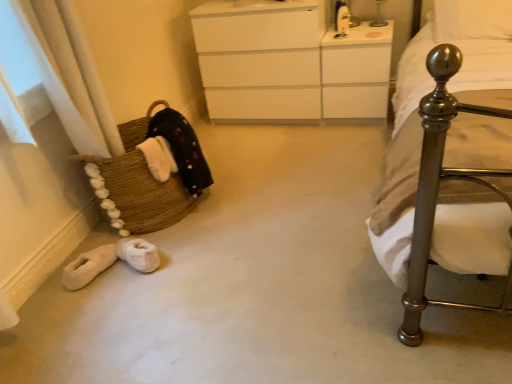
Identify the location of vacant area that is in front of white glossy vanity at upper center. (348, 142).